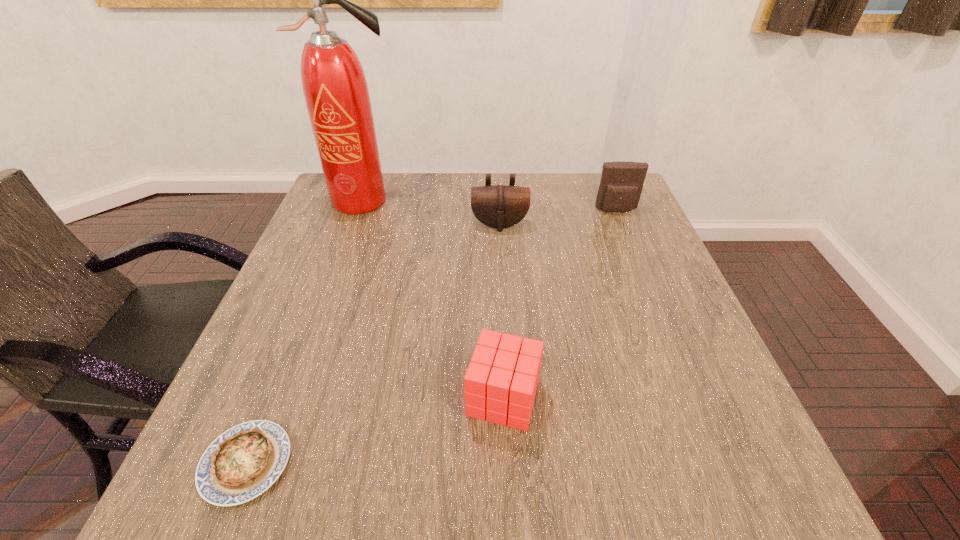
At what (x,y) coordinates should I click in order to perform the action: click on the tallest object. Please return your answer as a coordinate pair (x, y). Looking at the image, I should click on (336, 93).

Find the location of `the right pouch`. the right pouch is located at coordinates (621, 184).

I want to click on the farther pouch, so click(621, 184).

The image size is (960, 540). Identify the location of the nearer pouch. (498, 206).

Where is `the third farthest object`? This screenshot has height=540, width=960. the third farthest object is located at coordinates (498, 206).

You are a GUI agent. You are given a task and a screenshot of the screen. Output one action in this format:
    pyautogui.click(x=<x>, y=<y>)
    Task: Click on the second shortest object
    Image resolution: width=960 pixels, height=540 pixels.
    Given the screenshot: What is the action you would take?
    pyautogui.click(x=500, y=384)

Identify the location of quiche. (243, 462).

At what (x,y) coordinates should I click in order to perform the action: click on free space located 0.230m on the right of the tallest object. Please return your answer as a coordinate pair (x, y). This screenshot has width=960, height=540. Looking at the image, I should click on (481, 200).

Image resolution: width=960 pixels, height=540 pixels. In order to click on blank space located with an open flap on the farther pouch in this screenshot , I will do click(x=636, y=260).

You are a GUI agent. You are given a task and a screenshot of the screen. Output one action in this format:
    pyautogui.click(x=<x>, y=<y>)
    Task: Click on the vacant space located 0.390m with the flap open on the third nearest object
    
    Given the screenshot: What is the action you would take?
    pyautogui.click(x=507, y=354)